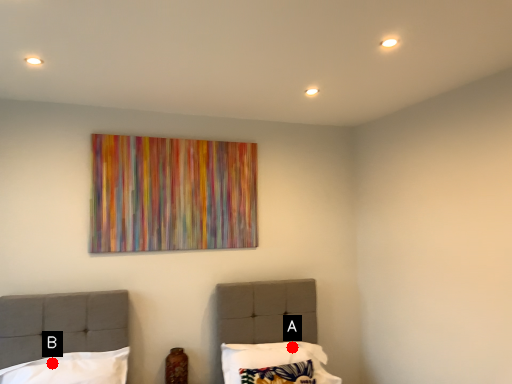
Question: Two points are circled on the image, labeled by A and B beside each circle. Which point is further to the camera?

Choices:
 (A) A is further
 (B) B is further

Answer: (A)